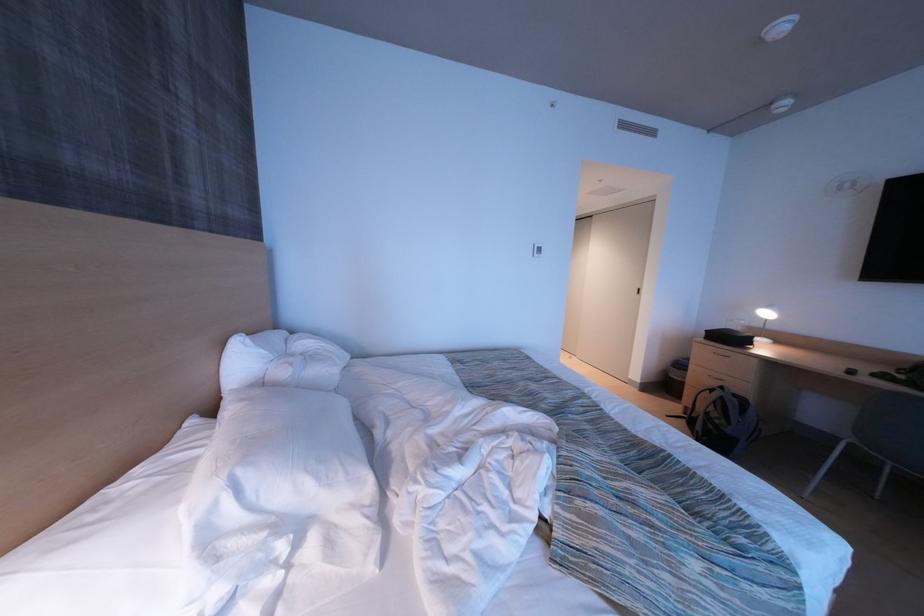
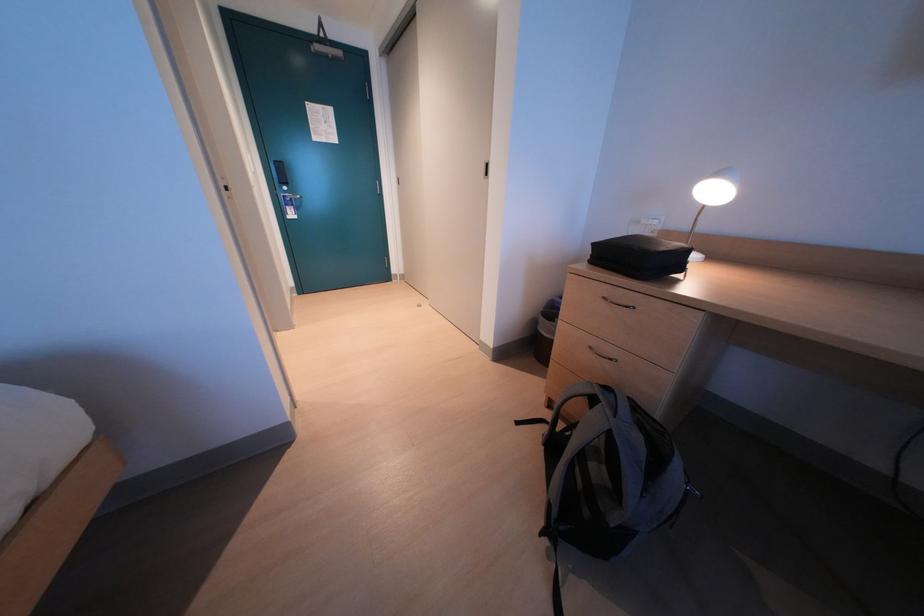
In a continuous first-person perspective shot, in which direction is the camera moving?

The cameraman moved toward right, forward.